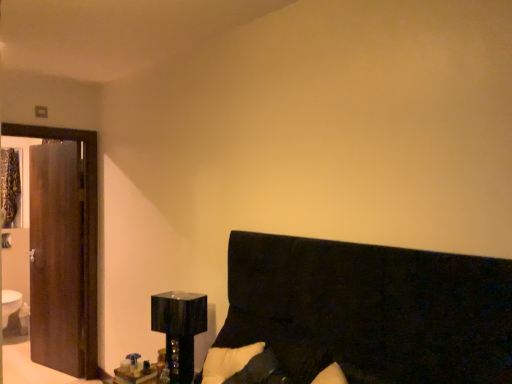
Question: From a real-world perspective, is black fabric headboard at lower right physically below glossy black cube at lower left?

Choices:
 (A) no
 (B) yes

Answer: (A)

Question: Does black fabric headboard at lower right have a lesser height compared to glossy black cube at lower left?

Choices:
 (A) no
 (B) yes

Answer: (A)

Question: Is black fabric headboard at lower right bigger than glossy black cube at lower left?

Choices:
 (A) no
 (B) yes

Answer: (B)

Question: Considering the relative sizes of black fabric headboard at lower right and glossy black cube at lower left in the image provided, is black fabric headboard at lower right smaller than glossy black cube at lower left?

Choices:
 (A) yes
 (B) no

Answer: (B)

Question: From a real-world perspective, is black fabric headboard at lower right physically above glossy black cube at lower left?

Choices:
 (A) yes
 (B) no

Answer: (A)

Question: Is black fabric headboard at lower right in front of glossy black cube at lower left?

Choices:
 (A) yes
 (B) no

Answer: (A)

Question: From a real-world perspective, is glossy black cube at lower left under black fabric headboard at lower right?

Choices:
 (A) yes
 (B) no

Answer: (A)

Question: Considering the relative sizes of glossy black cube at lower left and black fabric headboard at lower right in the image provided, is glossy black cube at lower left bigger than black fabric headboard at lower right?

Choices:
 (A) no
 (B) yes

Answer: (A)

Question: Does glossy black cube at lower left appear on the left side of black fabric headboard at lower right?

Choices:
 (A) no
 (B) yes

Answer: (B)

Question: Is glossy black cube at lower left facing away from black fabric headboard at lower right?

Choices:
 (A) yes
 (B) no

Answer: (B)

Question: Considering the relative sizes of glossy black cube at lower left and black fabric headboard at lower right in the image provided, is glossy black cube at lower left thinner than black fabric headboard at lower right?

Choices:
 (A) yes
 (B) no

Answer: (A)

Question: Does glossy black cube at lower left have a lesser height compared to black fabric headboard at lower right?

Choices:
 (A) yes
 (B) no

Answer: (A)

Question: Could you tell me if dark wood door at left is turned towards black fabric headboard at lower right?

Choices:
 (A) no
 (B) yes

Answer: (A)